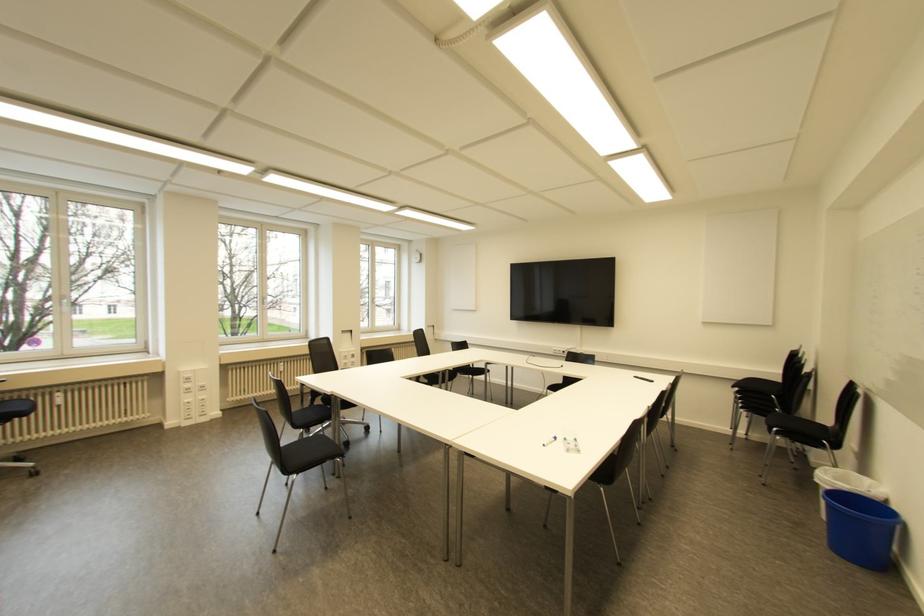
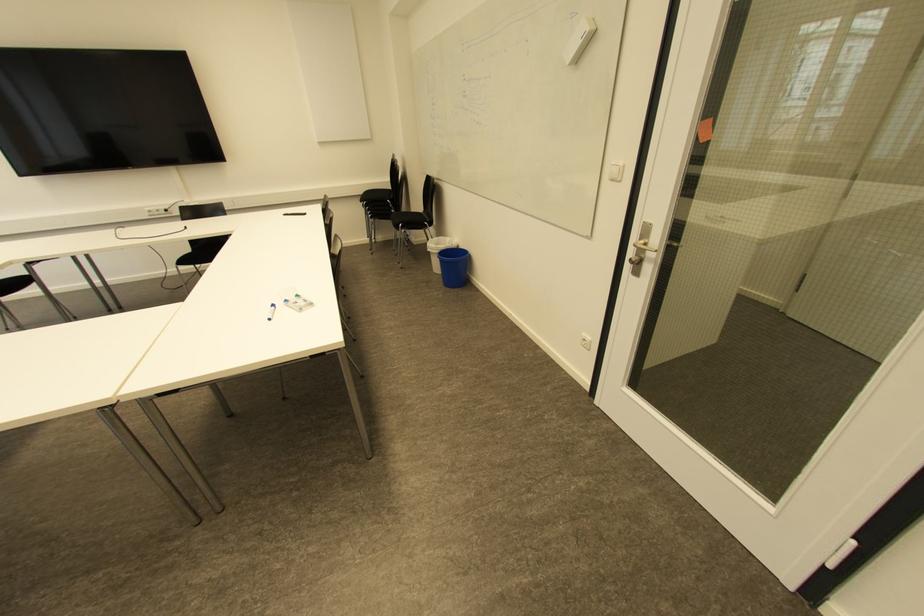
In the second image, find the point that corresponds to point 554,438 in the first image.

(273, 306)